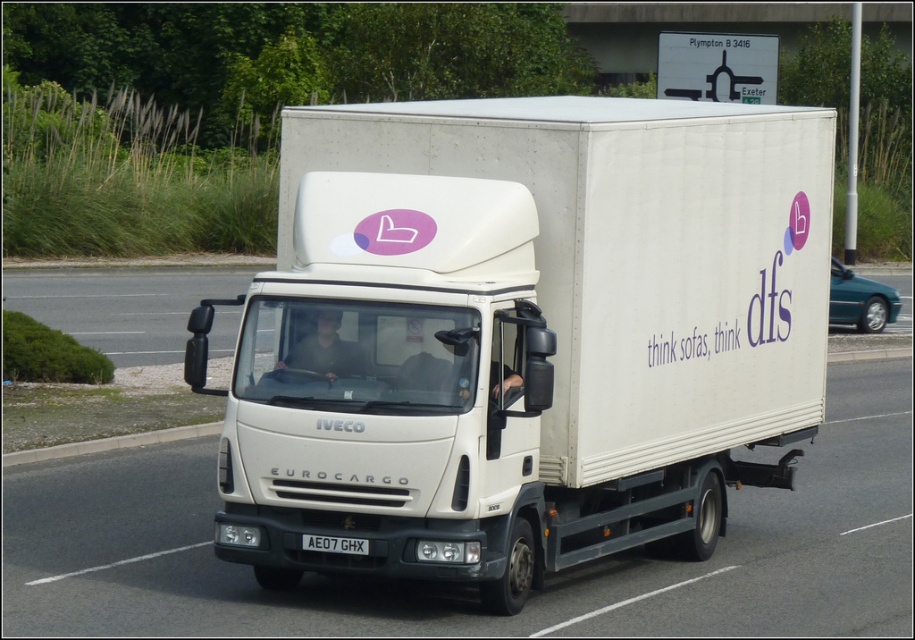
You are standing on the roadside and see the white Iveco Eurocargo truck driving past you. There is a specific point at coordinates (522, 333) that you want to mark on the truck. Where exactly on the truck would this point be located?

The point at coordinates (522, 333) corresponds to the white matte truck at center, so it would be located on the truck itself.

You are a traffic officer observing a white matte truck at center and a white plastic license plate at center. Which object is positioned to the right side?

The white matte truck at center is positioned to the right of the white plastic license plate at center.